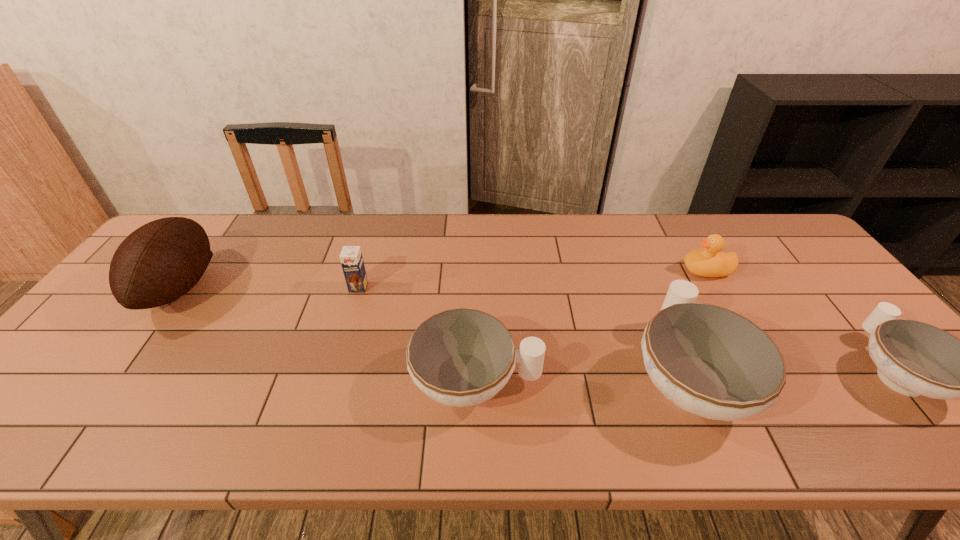
Locate an element on the screen. The width and height of the screenshot is (960, 540). vacant area located 0.080m on the side with the handle of the second chinaware from left to right is located at coordinates (655, 300).

Identify the location of vacant space situated on the laces of the tallest object. The image size is (960, 540). (320, 288).

The image size is (960, 540). I want to click on vacant space located on the front label of the fifth object from right to left, so click(x=351, y=310).

Locate an element on the screen. vacant point located 0.320m on the face of the duck is located at coordinates (576, 270).

Locate an element on the screen. The image size is (960, 540). vacant space located on the face of the duck is located at coordinates [596, 270].

Where is `vacant space located 0.160m on the face of the duck`? vacant space located 0.160m on the face of the duck is located at coordinates (630, 270).

You are a GUI agent. You are given a task and a screenshot of the screen. Output one action in this format:
    pyautogui.click(x=<x>, y=<y>)
    Task: Click on the object located in the far edge section of the desktop
    Image resolution: width=960 pixels, height=540 pixels.
    Given the screenshot: What is the action you would take?
    pyautogui.click(x=159, y=262)

Where is `object that is at the left edge`? Image resolution: width=960 pixels, height=540 pixels. object that is at the left edge is located at coordinates (159, 262).

Find the location of a particular element. This screenshot has width=960, height=540. object situated at the far left corner is located at coordinates [159, 262].

Identify the location of free space at the far edge. (503, 220).